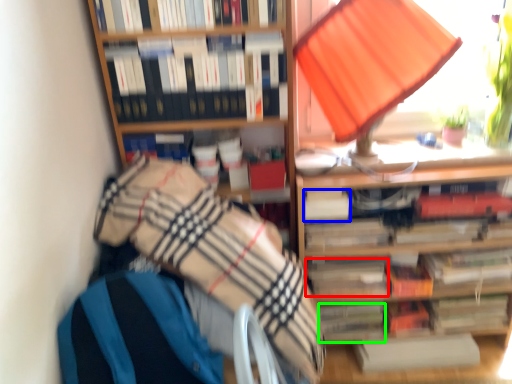
Question: Based on their relative distances, which object is farther from paperback book (highlighted by a red box)? Choose from paperback book (highlighted by a blue box) and paperback book (highlighted by a green box).

Choices:
 (A) paperback book
 (B) paperback book

Answer: (A)